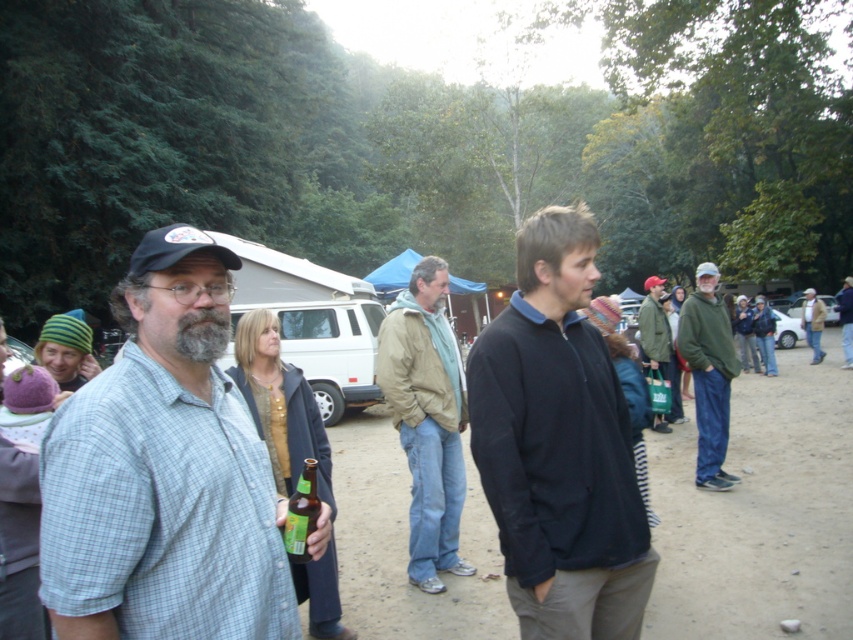
Question: Is light blue plaid shirt at center above green glass bottle at center?

Choices:
 (A) no
 (B) yes

Answer: (B)

Question: Among these points, which one is nearest to the camera?

Choices:
 (A) (407, 380)
 (B) (535, 273)

Answer: (B)

Question: Estimate the real-world distances between objects in this image. Which object is farther from the green glass bottle at center?

Choices:
 (A) dark blue jacket at center
 (B) light brown jacket at center

Answer: (A)

Question: Can you confirm if light blue plaid shirt at center is positioned below dark blue jacket at center?

Choices:
 (A) yes
 (B) no

Answer: (A)

Question: Which of the following is the farthest from the observer?

Choices:
 (A) (549, 566)
 (B) (310, 460)
 (C) (412, 376)
 (D) (648, 308)

Answer: (D)

Question: Does light blue plaid shirt at center appear under green glass bottle at center?

Choices:
 (A) yes
 (B) no

Answer: (B)